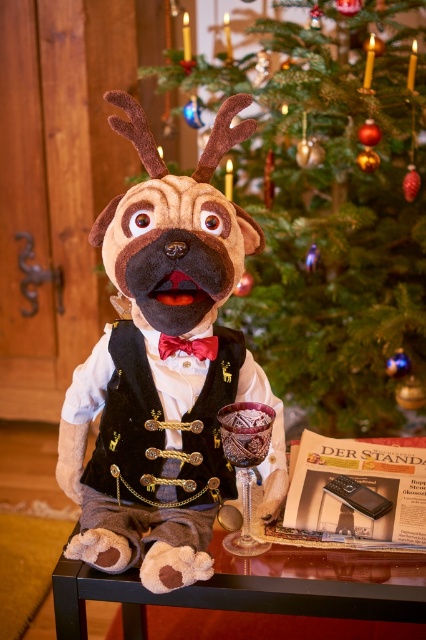
Question: Observing the image, what is the correct spatial positioning of shiny dark wood table at lower center in reference to translucent purple glass goblet at lower center?

Choices:
 (A) above
 (B) below

Answer: (B)

Question: Considering the real-world distances, which object is farthest from the red satin bow tie at center?

Choices:
 (A) shiny dark wood table at lower center
 (B) green textured christmas tree at center

Answer: (B)

Question: Is the position of green textured christmas tree at center more distant than that of shiny dark wood table at lower center?

Choices:
 (A) yes
 (B) no

Answer: (A)

Question: Observing the image, what is the correct spatial positioning of translucent purple glass goblet at lower center in reference to red satin bow tie at center?

Choices:
 (A) left
 (B) right

Answer: (B)

Question: Which of the following is the closest to the observer?

Choices:
 (A) felt plush dog at center
 (B) shiny dark wood table at lower center
 (C) green textured christmas tree at center
 (D) red satin bow tie at center

Answer: (A)

Question: Among these points, which one is farthest from the camera?

Choices:
 (A) (265, 419)
 (B) (325, 294)
 (C) (198, 540)
 (D) (172, 337)

Answer: (B)